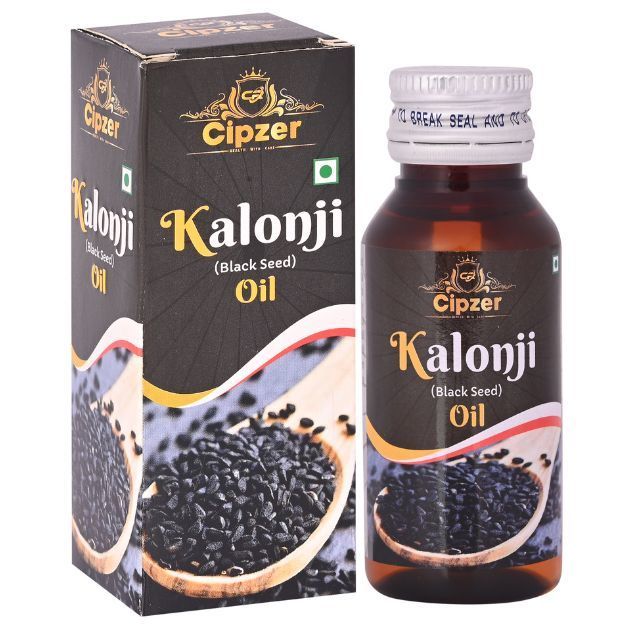
This screenshot has width=625, height=625. Identify the location of bottle. (517, 222).